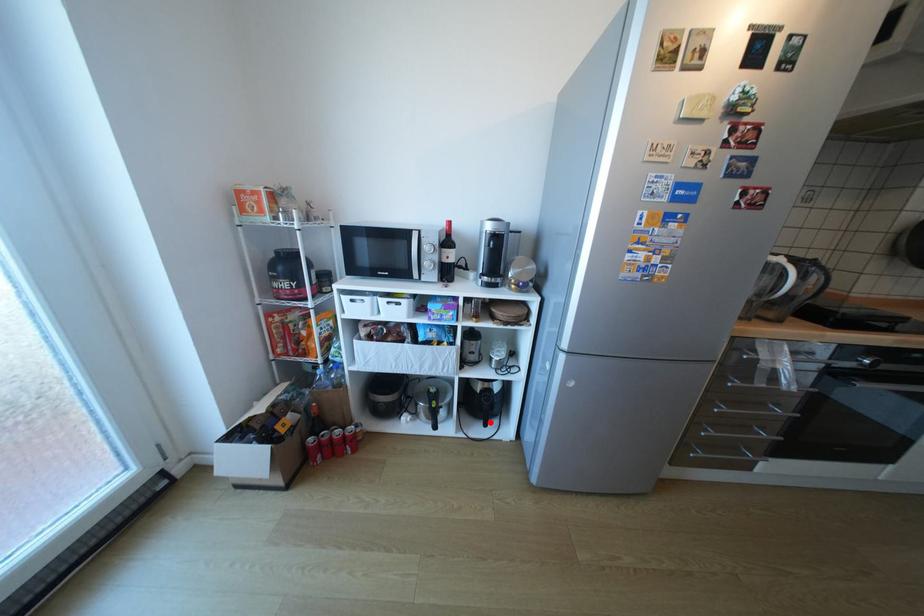
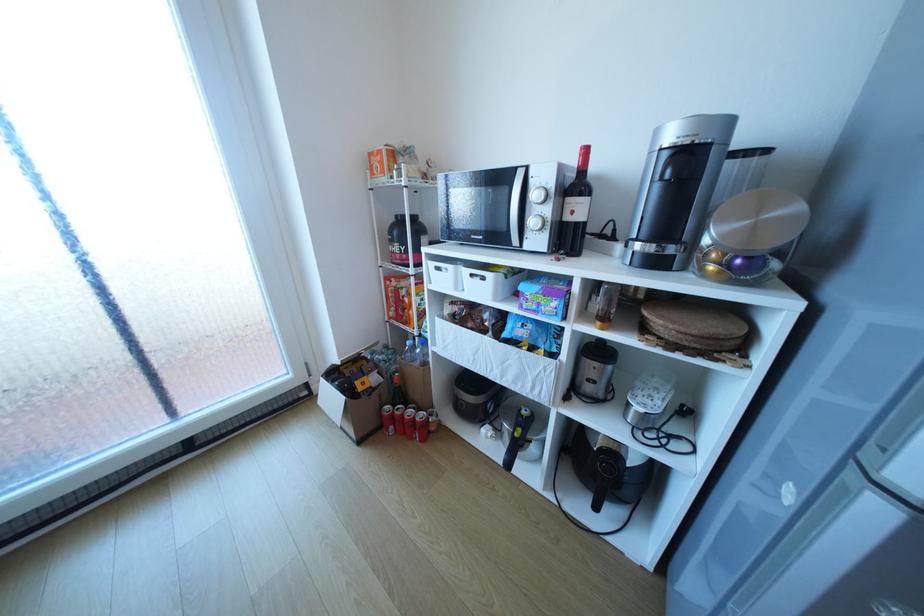
Question: I am providing you with two images of the same scene from different viewpoints. A red point is shown in image1. For the corresponding object point in image2, is it positioned nearer or farther from the camera?

Choices:
 (A) Nearer
 (B) Farther

Answer: (A)